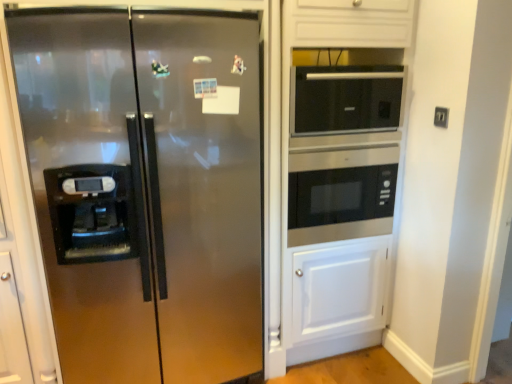
Question: Is black glass microwave at upper right, the first microwave oven positioned from the top, positioned far away from stainless steel refrigerator at left?

Choices:
 (A) no
 (B) yes

Answer: (A)

Question: Is stainless steel refrigerator at left completely or partially inside black glass microwave at upper right, which appears as the 2th microwave oven when ordered from the bottom?

Choices:
 (A) yes
 (B) no

Answer: (B)

Question: Is black glass microwave at upper right, the first microwave oven positioned from the top, facing towards stainless steel refrigerator at left?

Choices:
 (A) no
 (B) yes

Answer: (A)

Question: Considering the relative positions of black glass microwave at upper right, which appears as the 2th microwave oven when ordered from the bottom, and stainless steel refrigerator at left in the image provided, is black glass microwave at upper right, which appears as the 2th microwave oven when ordered from the bottom, to the right of stainless steel refrigerator at left from the viewer's perspective?

Choices:
 (A) yes
 (B) no

Answer: (A)

Question: From the image's perspective, does black glass microwave at upper right, which appears as the 2th microwave oven when ordered from the bottom, appear lower than stainless steel refrigerator at left?

Choices:
 (A) yes
 (B) no

Answer: (B)

Question: Is black glass microwave at upper right, which appears as the 2th microwave oven when ordered from the bottom, taller than stainless steel refrigerator at left?

Choices:
 (A) yes
 (B) no

Answer: (B)

Question: Is stainless steel microwave at center, the 1th microwave oven ordered from the bottom, bigger than stainless steel refrigerator at left?

Choices:
 (A) no
 (B) yes

Answer: (A)

Question: Is stainless steel microwave at center, the 1th microwave oven ordered from the bottom, thinner than stainless steel refrigerator at left?

Choices:
 (A) no
 (B) yes

Answer: (B)

Question: Is stainless steel microwave at center, which is the second microwave oven in top-to-bottom order, outside stainless steel refrigerator at left?

Choices:
 (A) no
 (B) yes

Answer: (B)

Question: Does stainless steel microwave at center, which is the second microwave oven in top-to-bottom order, turn towards stainless steel refrigerator at left?

Choices:
 (A) yes
 (B) no

Answer: (B)

Question: Is stainless steel microwave at center, which is the second microwave oven in top-to-bottom order, directly adjacent to stainless steel refrigerator at left?

Choices:
 (A) no
 (B) yes

Answer: (A)

Question: From a real-world perspective, is stainless steel microwave at center, the 1th microwave oven ordered from the bottom, on top of stainless steel refrigerator at left?

Choices:
 (A) yes
 (B) no

Answer: (A)

Question: Is black plastic electric outlet at upper right at the left side of black glass microwave at upper right, which appears as the 2th microwave oven when ordered from the bottom?

Choices:
 (A) yes
 (B) no

Answer: (B)